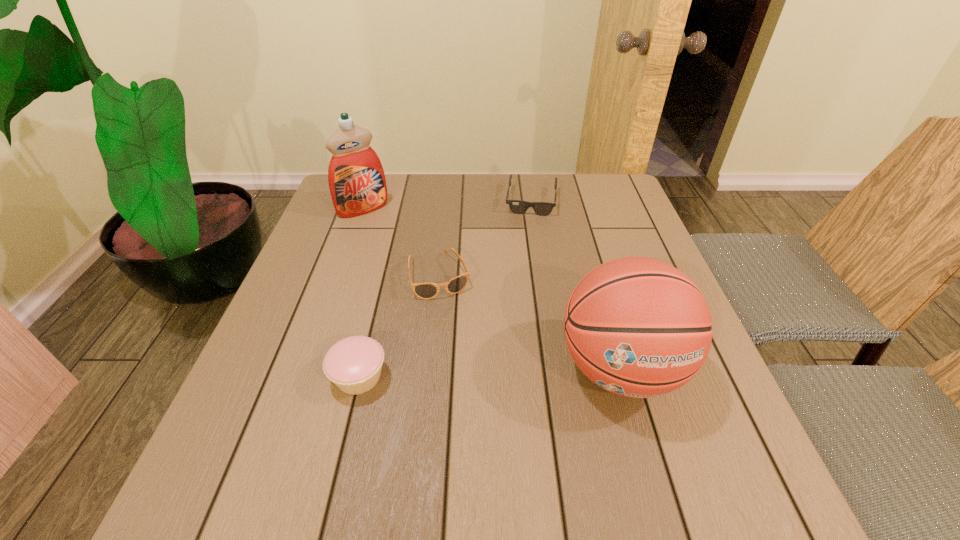
You are a GUI agent. You are given a task and a screenshot of the screen. Output one action in this format:
    pyautogui.click(x=<x>, y=<y>)
    Task: Click on the vacant space on the desktop that is between the cupcake and the basketball and is positioned on the temples of the farther sunglasses
    The width and height of the screenshot is (960, 540).
    Given the screenshot: What is the action you would take?
    pyautogui.click(x=513, y=372)

The height and width of the screenshot is (540, 960). Identify the location of free space on the desktop that is between the cupcake and the basketball and is positioned on the front surface of the detergent. (505, 372).

Image resolution: width=960 pixels, height=540 pixels. In order to click on free spot on the desktop that is between the third shortest object and the basketball and is positioned on the front-facing side of the third nearest object in this screenshot , I will do `click(474, 373)`.